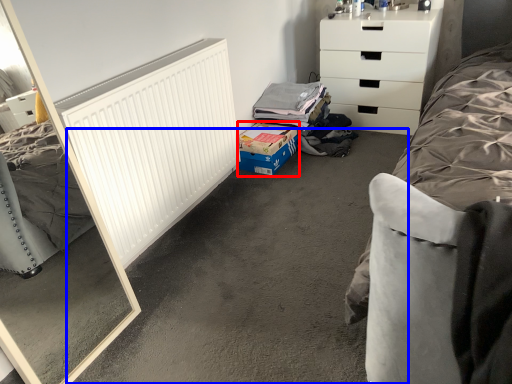
Question: Among these objects, which one is farthest to the camera, cardboard box (highlighted by a red box) or concrete (highlighted by a blue box)?

Choices:
 (A) cardboard box
 (B) concrete

Answer: (A)